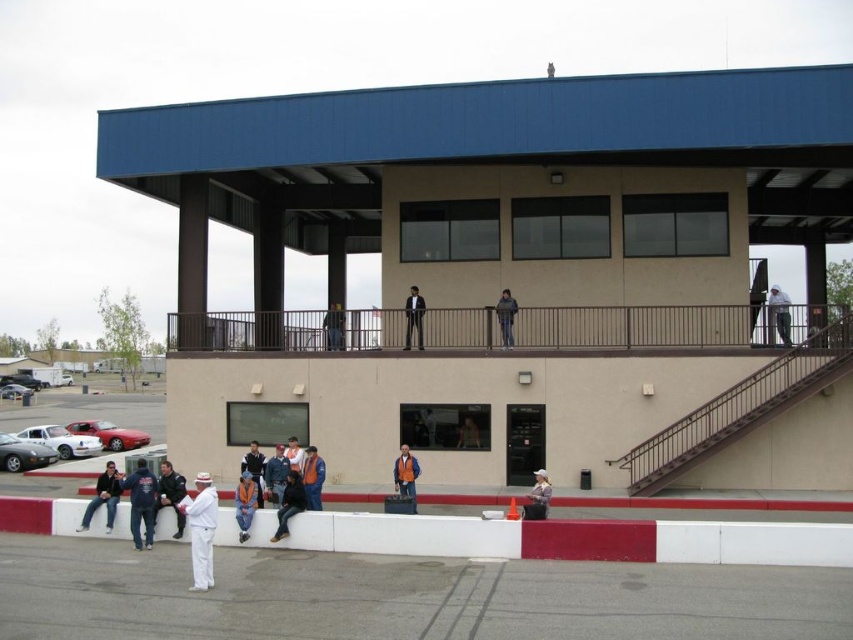
Does denim jacket at lower left have a smaller size compared to dark gray suit at upper center?

Yes.

Can you confirm if denim jacket at lower left is positioned above dark gray suit at upper center?

No, denim jacket at lower left is not above dark gray suit at upper center.

Is point (109, 499) positioned before point (418, 307)?

Yes, it is.

The height and width of the screenshot is (640, 853). I want to click on denim jacket at lower left, so click(103, 497).

Can you confirm if dark blue jacket at lower left is bigger than orange reflective vest at center?

Correct, dark blue jacket at lower left is larger in size than orange reflective vest at center.

Does dark blue jacket at lower left appear on the right side of orange reflective vest at center?

Incorrect, dark blue jacket at lower left is not on the right side of orange reflective vest at center.

The height and width of the screenshot is (640, 853). Find the location of `dark blue jacket at lower left`. dark blue jacket at lower left is located at coordinates (141, 502).

Is the position of dark blue jacket at lower center less distant than that of dark blue jeans at upper center?

Yes, dark blue jacket at lower center is in front of dark blue jeans at upper center.

Is dark blue jacket at lower center to the left of dark blue jeans at upper center from the viewer's perspective?

In fact, dark blue jacket at lower center is to the right of dark blue jeans at upper center.

Which is behind, point (299, 483) or point (328, 340)?

Point (328, 340)

What are the coordinates of `dark blue jacket at lower center` in the screenshot? It's located at (289, 502).